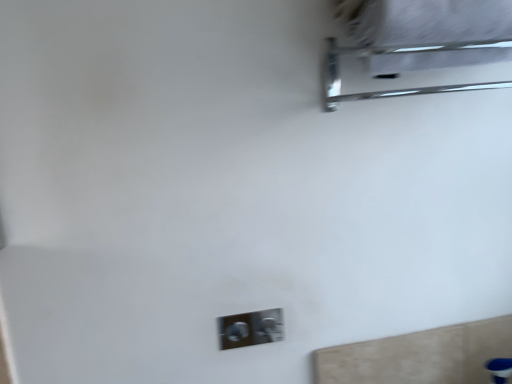
What is the approximate width of satin silver switch at lower center?

The width of satin silver switch at lower center is 1.11 centimeters.

The width and height of the screenshot is (512, 384). Describe the element at coordinates (250, 328) in the screenshot. I see `satin silver switch at lower center` at that location.

This screenshot has width=512, height=384. Identify the location of satin silver switch at lower center. (250, 328).

Where is `metallic chrome towel rack at upper right`? This screenshot has height=384, width=512. metallic chrome towel rack at upper right is located at coordinates (397, 53).

What do you see at coordinates (397, 53) in the screenshot?
I see `metallic chrome towel rack at upper right` at bounding box center [397, 53].

What is the approximate height of metallic chrome towel rack at upper right?

metallic chrome towel rack at upper right is 6.85 inches in height.

Measure the distance between point (458, 48) and camera.

They are 81.70 centimeters apart.

Image resolution: width=512 pixels, height=384 pixels. In order to click on satin silver switch at lower center in this screenshot , I will do `click(250, 328)`.

Is satin silver switch at lower center to the left of metallic chrome towel rack at upper right from the viewer's perspective?

Correct, you'll find satin silver switch at lower center to the left of metallic chrome towel rack at upper right.

Considering their positions, is satin silver switch at lower center located in front of or behind metallic chrome towel rack at upper right?

Visually, satin silver switch at lower center is located behind metallic chrome towel rack at upper right.

Is point (273, 316) positioned behind point (326, 39)?

Yes, point (273, 316) is farther from viewer.

From the image's perspective, is satin silver switch at lower center above or below metallic chrome towel rack at upper right?

satin silver switch at lower center is below metallic chrome towel rack at upper right.

From a real-world perspective, is satin silver switch at lower center physically above metallic chrome towel rack at upper right?

No.

In terms of width, does satin silver switch at lower center look wider or thinner when compared to metallic chrome towel rack at upper right?

satin silver switch at lower center is thinner than metallic chrome towel rack at upper right.

Can you confirm if satin silver switch at lower center is shorter than metallic chrome towel rack at upper right?

Yes.

Does satin silver switch at lower center have a smaller size compared to metallic chrome towel rack at upper right?

Indeed, satin silver switch at lower center has a smaller size compared to metallic chrome towel rack at upper right.

From the picture: Is satin silver switch at lower center completely or partially outside of metallic chrome towel rack at upper right?

Yes, satin silver switch at lower center is outside of metallic chrome towel rack at upper right.

Is there a large distance between satin silver switch at lower center and metallic chrome towel rack at upper right?

satin silver switch at lower center is near metallic chrome towel rack at upper right, not far away.

Is satin silver switch at lower center oriented away from metallic chrome towel rack at upper right?

No.

Measure the distance from satin silver switch at lower center to metallic chrome towel rack at upper right.

satin silver switch at lower center is 23.48 inches away from metallic chrome towel rack at upper right.

Where is `furniture that appears on the right of satin silver switch at lower center`? Image resolution: width=512 pixels, height=384 pixels. furniture that appears on the right of satin silver switch at lower center is located at coordinates (397, 53).

Would you say metallic chrome towel rack at upper right is to the left or to the right of satin silver switch at lower center in the picture?

metallic chrome towel rack at upper right is to the right of satin silver switch at lower center.

Which is in front, metallic chrome towel rack at upper right or satin silver switch at lower center?

Positioned in front is metallic chrome towel rack at upper right.

Between point (410, 50) and point (262, 330), which one is positioned behind?

The point (262, 330) is farther.

From the image's perspective, is metallic chrome towel rack at upper right beneath satin silver switch at lower center?

No.

From a real-world perspective, between metallic chrome towel rack at upper right and satin silver switch at lower center, who is vertically higher?

In real-world perspective, metallic chrome towel rack at upper right is above.

Which object is wider, metallic chrome towel rack at upper right or satin silver switch at lower center?

metallic chrome towel rack at upper right.

Is metallic chrome towel rack at upper right shorter than satin silver switch at lower center?

In fact, metallic chrome towel rack at upper right may be taller than satin silver switch at lower center.

Who is bigger, metallic chrome towel rack at upper right or satin silver switch at lower center?

Bigger between the two is metallic chrome towel rack at upper right.

Is metallic chrome towel rack at upper right completely or partially outside of satin silver switch at lower center?

metallic chrome towel rack at upper right is positioned outside satin silver switch at lower center.

Is metallic chrome towel rack at upper right with satin silver switch at lower center?

No, metallic chrome towel rack at upper right is not in contact with satin silver switch at lower center.

Is metallic chrome towel rack at upper right facing away from satin silver switch at lower center?

No, metallic chrome towel rack at upper right is not facing away from satin silver switch at lower center.

I want to click on furniture above the satin silver switch at lower center (from a real-world perspective), so click(397, 53).

You are a GUI agent. You are given a task and a screenshot of the screen. Output one action in this format:
    pyautogui.click(x=<x>, y=<y>)
    Task: Click on the light switch that is behind the metallic chrome towel rack at upper right
    
    Given the screenshot: What is the action you would take?
    pyautogui.click(x=250, y=328)

At what (x,y) coordinates should I click in order to perform the action: click on furniture on the right side of satin silver switch at lower center. Please return your answer as a coordinate pair (x, y). The image size is (512, 384). Looking at the image, I should click on (397, 53).